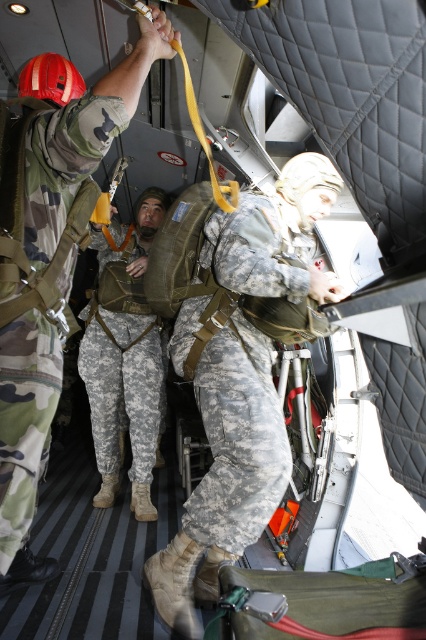
Question: Can you confirm if camouflage uniform at center is smaller than camouflage fabric pants at center?

Choices:
 (A) no
 (B) yes

Answer: (B)

Question: Does camouflage fabric uniform at center appear on the left side of camouflage fabric pants at center?

Choices:
 (A) no
 (B) yes

Answer: (A)

Question: Does camouflage fabric uniform at center appear on the left side of camouflage uniform at center?

Choices:
 (A) no
 (B) yes

Answer: (A)

Question: Estimate the real-world distances between objects in this image. Which object is farther from the camouflage fabric pants at center?

Choices:
 (A) camouflage fabric uniform at center
 (B) camouflage uniform at center

Answer: (B)

Question: Considering the real-world distances, which object is closest to the camouflage uniform at center?

Choices:
 (A) camouflage fabric uniform at center
 (B) camouflage fabric pants at center

Answer: (A)

Question: Which of the following is the closest to the observer?

Choices:
 (A) camouflage fabric uniform at center
 (B) camouflage uniform at center

Answer: (B)